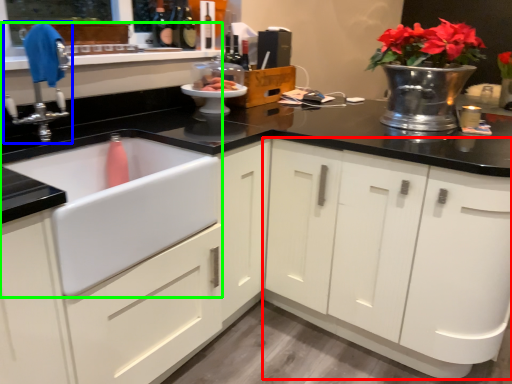
Question: Which object is positioned closest to cabinetry (highlighted by a red box)? Select from tap (highlighted by a blue box) and sink (highlighted by a green box).

Choices:
 (A) tap
 (B) sink

Answer: (B)